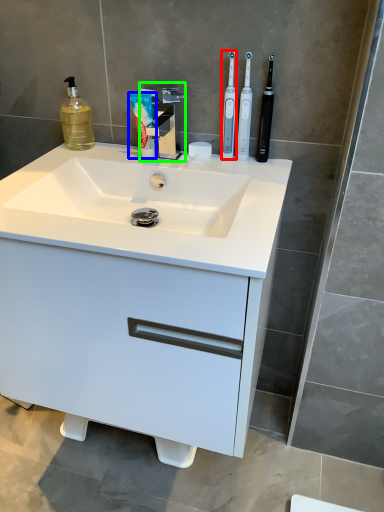
Question: Considering the real-world distances, which object is farthest from toothbrush (highlighted by a red box)? toothpaste (highlighted by a blue box) or tap (highlighted by a green box)?

Choices:
 (A) toothpaste
 (B) tap

Answer: (A)